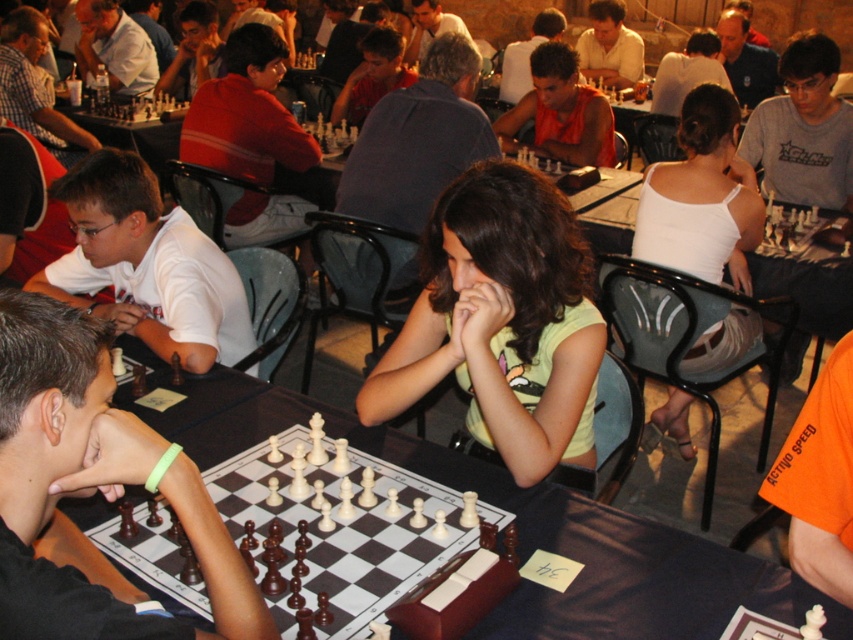
Based on the photo, in the chess tournament scene, there are two participants wearing a black shirt at left and a white tank top at center. Which participant is shorter in height?

The black shirt at left has a lesser height compared to white tank top at center, so the participant wearing the black shirt at left is shorter.

You are standing in the chess tournament and want to place a small decorative item on the table. You have two options to choose from. One is to place it at point [409,488] and the other is at point [573,81]. Which point is closer to you?

Point [409,488] is closer to the viewer than point [573,81].